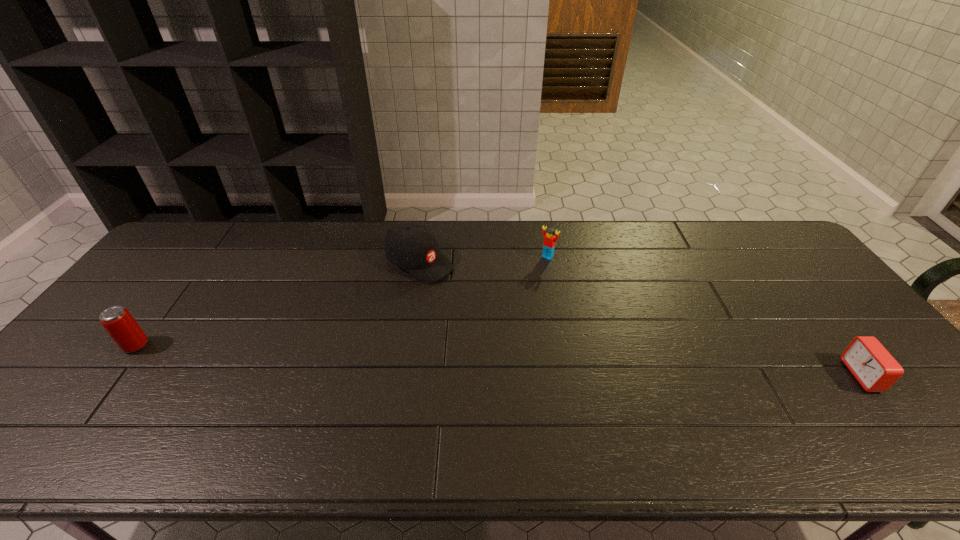
You are a GUI agent. You are given a task and a screenshot of the screen. Output one action in this format:
    pyautogui.click(x=<x>, y=<y>)
    Task: Click on the beer can
    This screenshot has height=540, width=960.
    Given the screenshot: What is the action you would take?
    pyautogui.click(x=124, y=330)

Locate an element on the screen. The image size is (960, 540). the leftmost object is located at coordinates (124, 330).

Locate an element on the screen. the shortest object is located at coordinates (875, 369).

The height and width of the screenshot is (540, 960). I want to click on the nearest object, so click(875, 369).

Locate an element on the screen. The width and height of the screenshot is (960, 540). Lego is located at coordinates (549, 240).

Find the location of a particular element. baseball cap is located at coordinates (413, 247).

Where is `vacant space located 0.090m on the back of the beer can`? Image resolution: width=960 pixels, height=540 pixels. vacant space located 0.090m on the back of the beer can is located at coordinates tap(161, 313).

Where is `blank space located on the front-facing side of the nearest object`? The width and height of the screenshot is (960, 540). blank space located on the front-facing side of the nearest object is located at coordinates tap(702, 375).

This screenshot has width=960, height=540. In order to click on free space located on the front-facing side of the nearest object in this screenshot , I will do `click(762, 375)`.

Where is `vacant region located 0.390m on the front-facing side of the nearest object`? The image size is (960, 540). vacant region located 0.390m on the front-facing side of the nearest object is located at coordinates (694, 375).